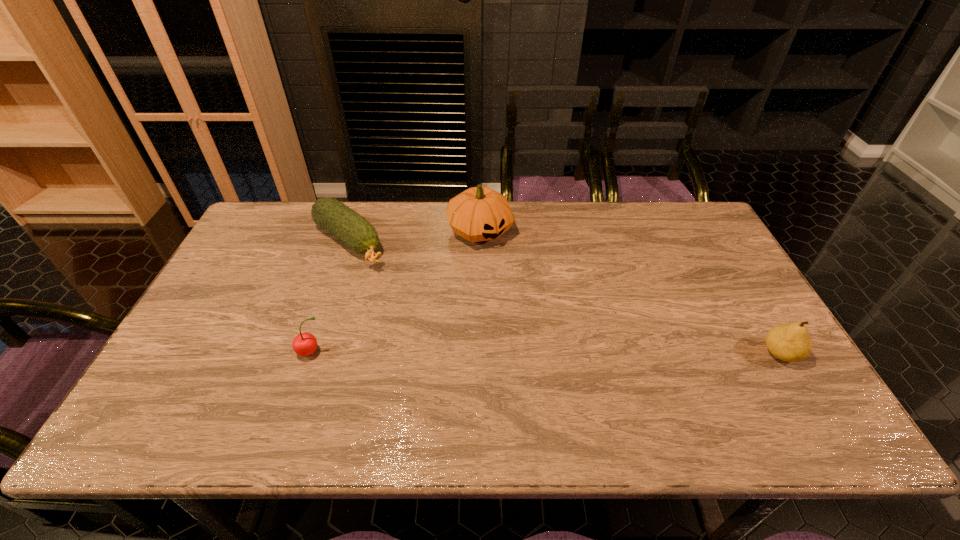
Identify the location of vacant position at the right edge of the desktop. The height and width of the screenshot is (540, 960). (724, 348).

Identify the location of vacant space at the far left corner of the desktop. This screenshot has height=540, width=960. (271, 228).

You are a GUI agent. You are given a task and a screenshot of the screen. Output one action in this format:
    pyautogui.click(x=<x>, y=<y>)
    Task: Click on the free region at the far right corner
    This screenshot has width=960, height=540.
    Given the screenshot: What is the action you would take?
    pyautogui.click(x=676, y=214)

The image size is (960, 540). I want to click on vacant space that's between the rightmost object and the third object from left to right, so click(x=631, y=292).

At what (x,y) coordinates should I click in order to perform the action: click on blank region between the pear and the tallest object. Please return your answer as a coordinate pair (x, y). The height and width of the screenshot is (540, 960). Looking at the image, I should click on (631, 292).

At what (x,y) coordinates should I click in order to perform the action: click on empty space between the cherry and the second object from right to left. Please return your answer as a coordinate pair (x, y). Looking at the image, I should click on (396, 292).

This screenshot has height=540, width=960. I want to click on free space between the pear and the shortest object, so click(x=564, y=298).

Where is `empty space that is in between the rightmost object and the gourd`? The image size is (960, 540). empty space that is in between the rightmost object and the gourd is located at coordinates (631, 292).

This screenshot has height=540, width=960. I want to click on vacant point located between the shortest object and the gourd, so click(x=414, y=237).

The width and height of the screenshot is (960, 540). Find the location of `vacant space in between the pear and the cherry`. vacant space in between the pear and the cherry is located at coordinates (546, 353).